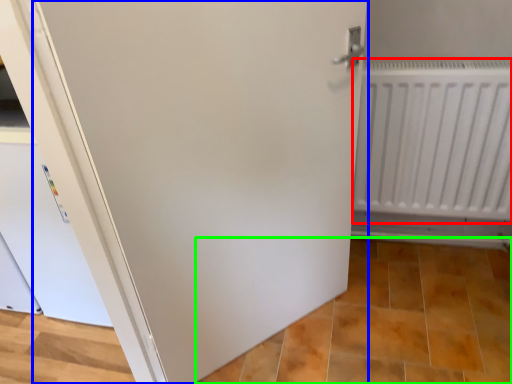
Question: Which object is positioned farthest from radiator (highlighted by a red box)? Select from door (highlighted by a blue box) and tile (highlighted by a green box).

Choices:
 (A) door
 (B) tile

Answer: (B)